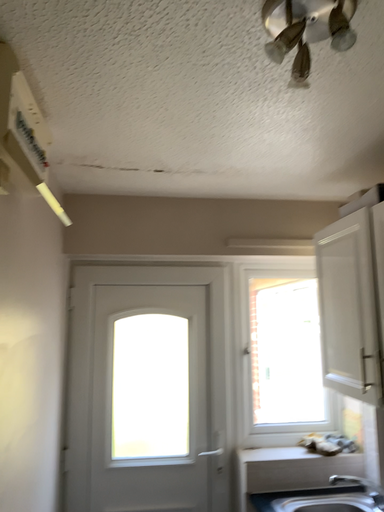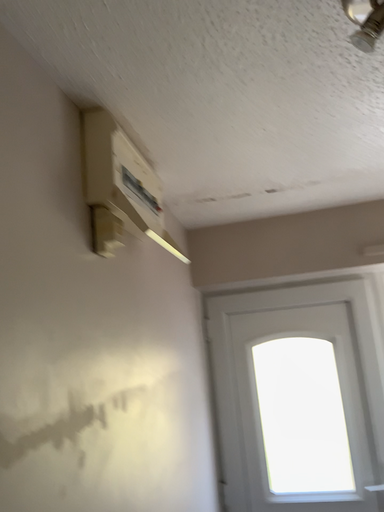
Question: Which way did the camera rotate in the video?

Choices:
 (A) rotated left
 (B) rotated right

Answer: (A)